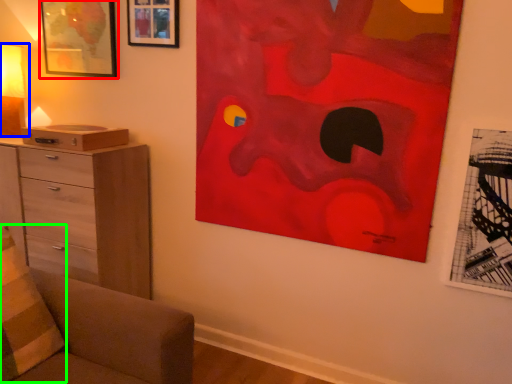
Question: Considering the real-world distances, which object is farthest from picture frame (highlighted by a red box)? table lamp (highlighted by a blue box) or pillow (highlighted by a green box)?

Choices:
 (A) table lamp
 (B) pillow

Answer: (B)